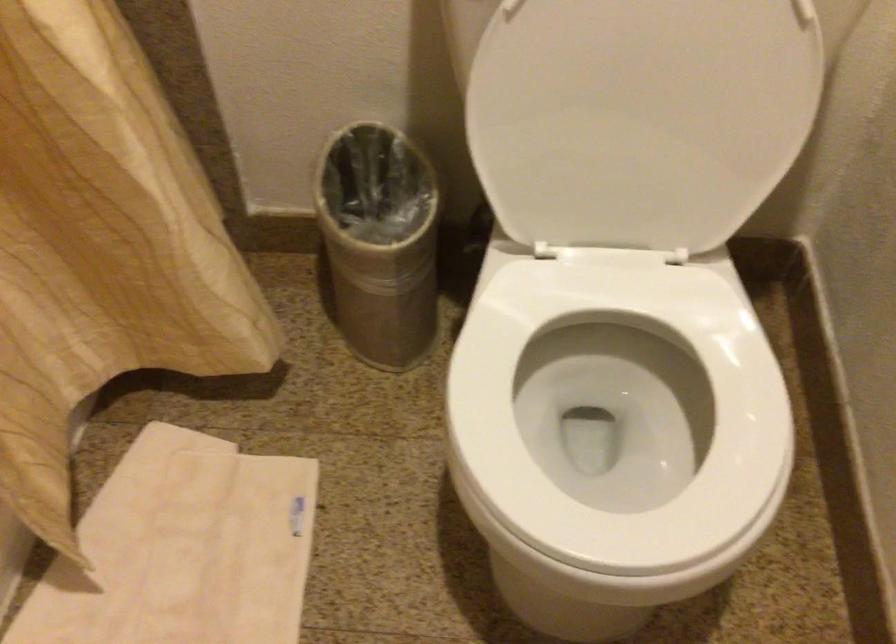
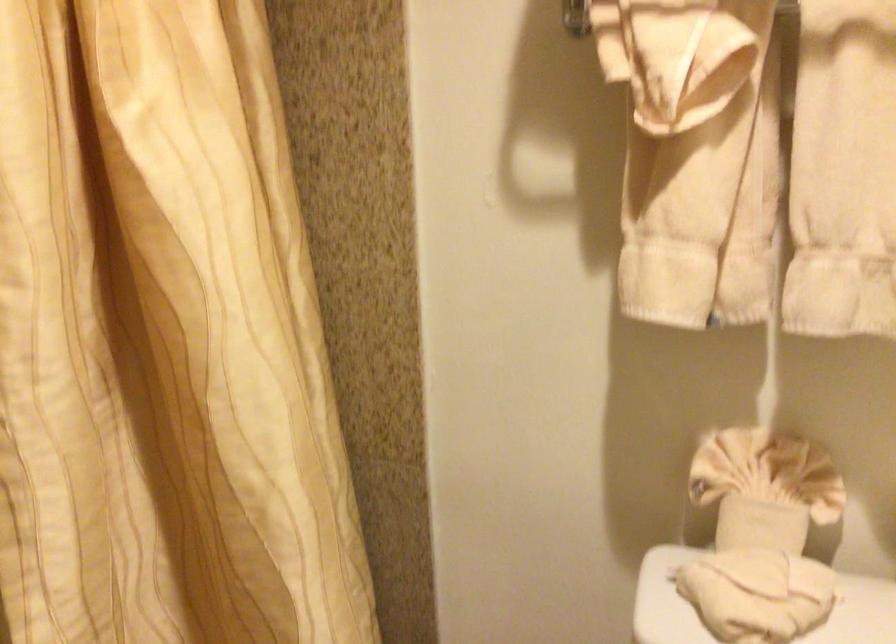
Based on the continuous images, in which direction is the camera rotating?

The camera's rotation is toward left-up.